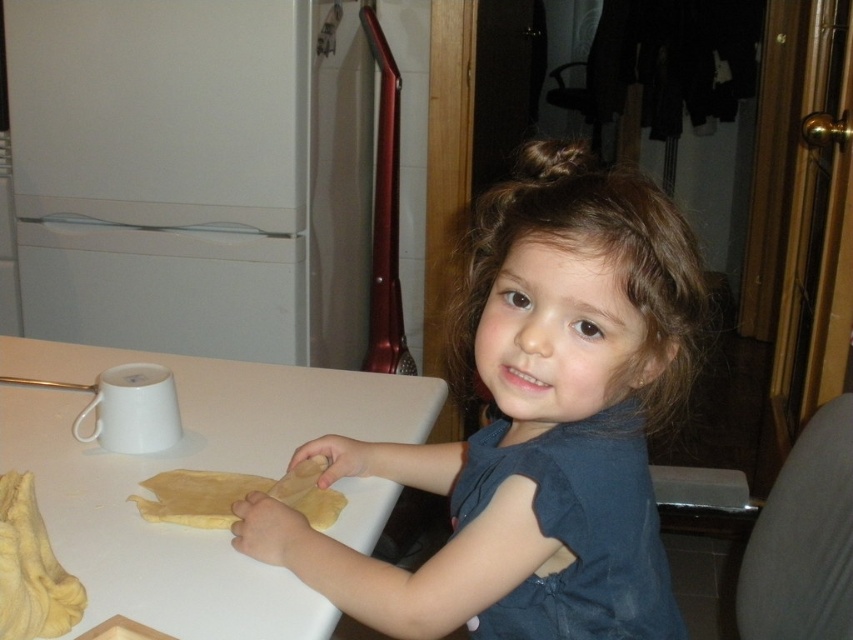
The child is trying to place a cookie cutter on the table. The cookie cutter is to the right of the yellow dough at center. Is the cookie cutter on the left or right side of the white matte table at center?

The cookie cutter is to the right of the yellow dough at center. Since the white matte table at center is to the left of the yellow dough at center, the cookie cutter would be on the right side of the white matte table at center.

You are a photographer trying to capture the child and the table in the image. Since the smooth brown hair at center and the white matte table at center are both important, which one should you focus on to ensure both are in sharp focus?

The smooth brown hair at center is in front of the white matte table at center, so focusing on the smooth brown hair at center will keep it sharp while the table may be slightly out of focus. To ensure both are in sharp focus, adjust the focus to a point between them or use a smaller aperture for a deeper depth of field.